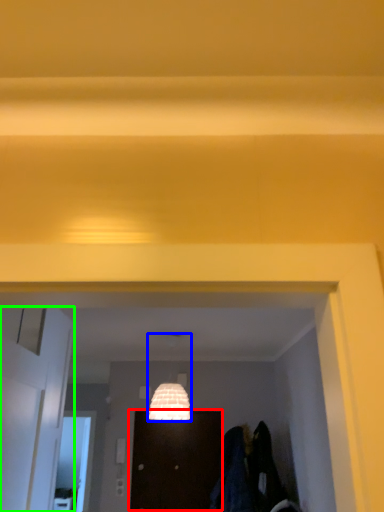
Question: Which object is the closest to the door (highlighted by a red box)? Choose among these: lamp (highlighted by a blue box) or door (highlighted by a green box).

Choices:
 (A) lamp
 (B) door

Answer: (A)